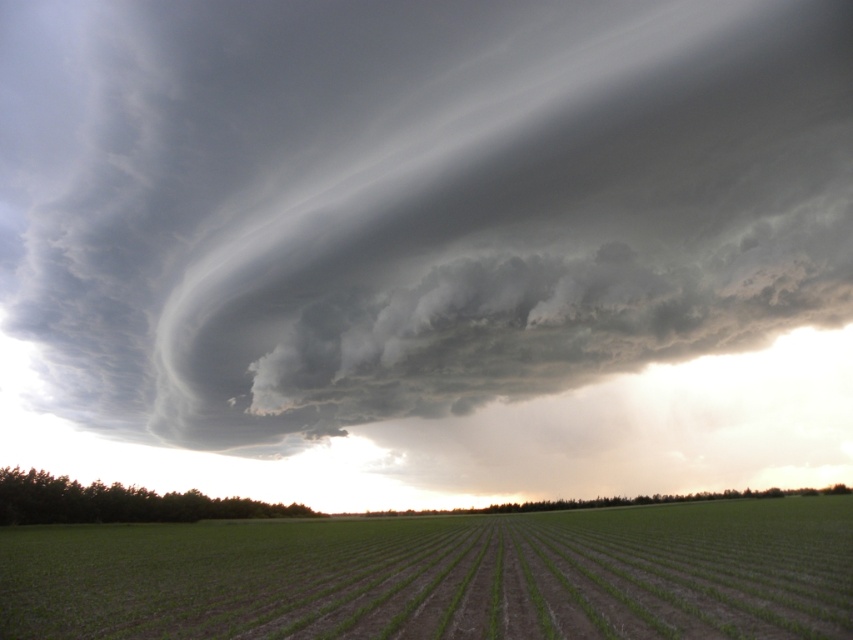
Question: Can you confirm if dark gray cloud at upper center is positioned below green grass at center?

Choices:
 (A) yes
 (B) no

Answer: (B)

Question: Among these points, which one is nearest to the camera?

Choices:
 (A) (775, 176)
 (B) (610, 570)

Answer: (B)

Question: Where is dark gray cloud at upper center located in relation to green grass at center in the image?

Choices:
 (A) right
 (B) left

Answer: (B)

Question: Does dark gray cloud at upper center appear on the right side of green grass at center?

Choices:
 (A) yes
 (B) no

Answer: (B)